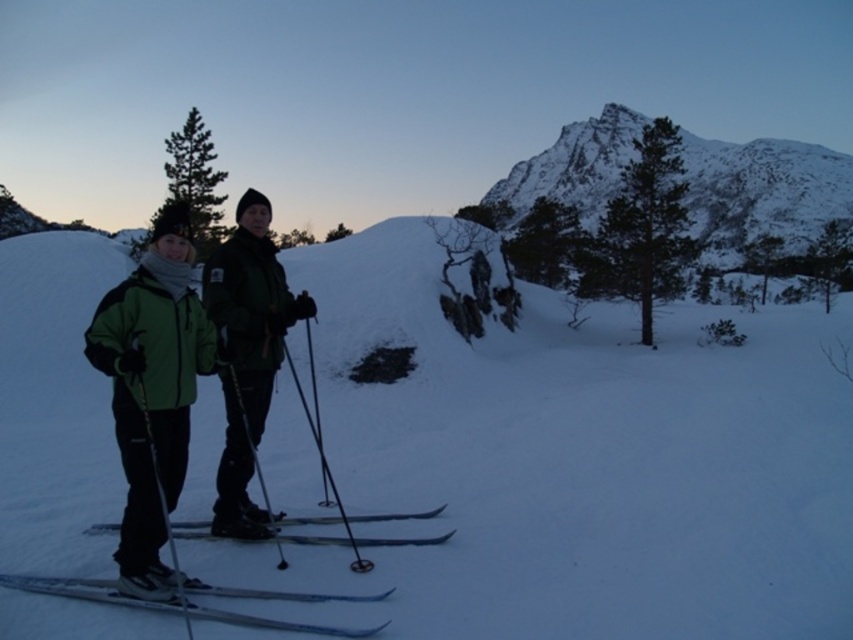
Describe the element at coordinates (573, 464) in the screenshot. I see `white powder snow at center` at that location.

Is white powder snow at center further to camera compared to green matte jacket at left?

That is False.

At what (x,y) coordinates should I click in order to perform the action: click on white powder snow at center. Please return your answer as a coordinate pair (x, y). This screenshot has height=640, width=853. Looking at the image, I should click on (573, 464).

Find the location of a particular element. white powder snow at center is located at coordinates (573, 464).

Can you confirm if white powder snow at center is shorter than metallic ski pole at left?

In fact, white powder snow at center may be taller than metallic ski pole at left.

Who is higher up, white powder snow at center or metallic ski pole at left?

white powder snow at center is higher up.

At what (x,y) coordinates should I click in order to perform the action: click on white powder snow at center. Please return your answer as a coordinate pair (x, y). The height and width of the screenshot is (640, 853). Looking at the image, I should click on (573, 464).

Identify the location of white powder snow at center. The height and width of the screenshot is (640, 853). point(573,464).

Who is lower down, silver metallic skis at lower center or black matte ski pole at center?

silver metallic skis at lower center is lower down.

Who is positioned more to the left, silver metallic skis at lower center or black matte ski pole at center?

silver metallic skis at lower center is more to the left.

Find the location of a particular element. silver metallic skis at lower center is located at coordinates (164, 604).